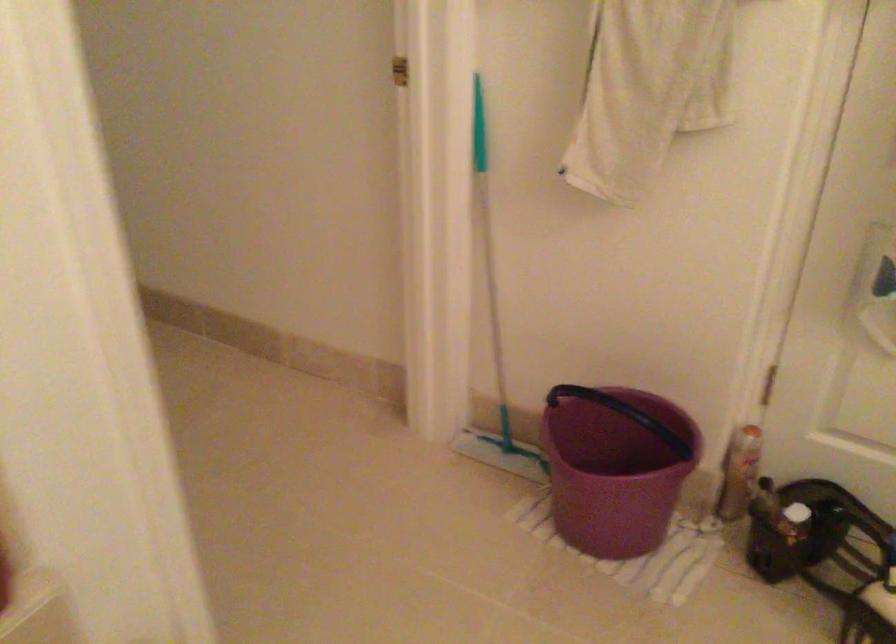
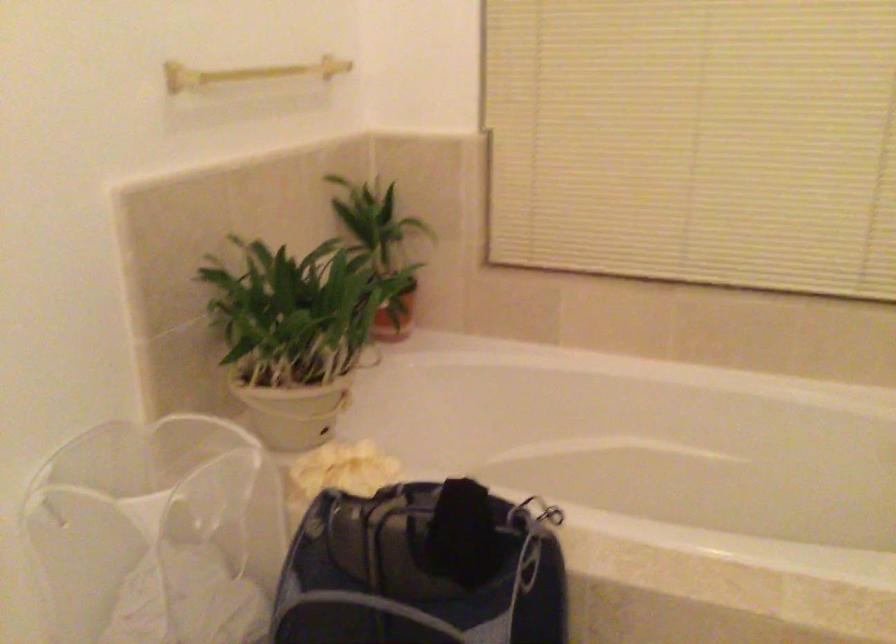
Question: The camera is either moving clockwise (left) or counter-clockwise (right) around the object. The first image is from the beginning of the video and the second image is from the end. Is the camera moving left or right when shooting the video?

Choices:
 (A) Left
 (B) Right

Answer: (B)